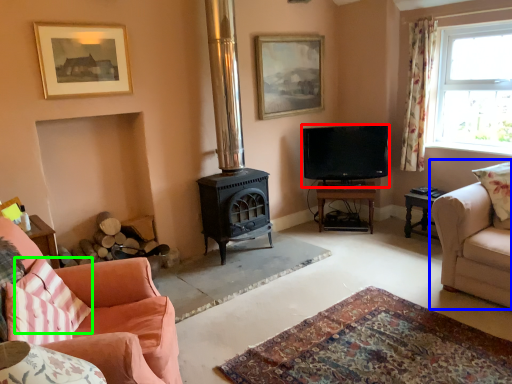
Question: Which is nearer to the television (highlighted by a red box)? studio couch (highlighted by a blue box) or pillow (highlighted by a green box).

Choices:
 (A) studio couch
 (B) pillow

Answer: (A)